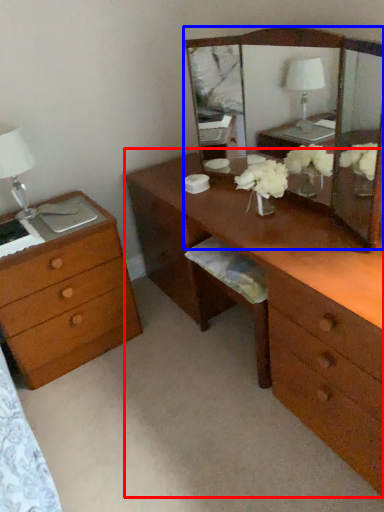
Question: Which object appears closest to the camera in this image, desk (highlighted by a red box) or mirror (highlighted by a blue box)?

Choices:
 (A) desk
 (B) mirror

Answer: (A)